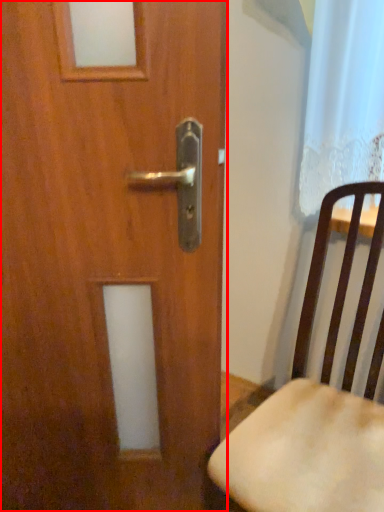
Question: From the image's perspective, where is door (annotated by the red box) located in relation to chair in the image?

Choices:
 (A) above
 (B) below

Answer: (A)